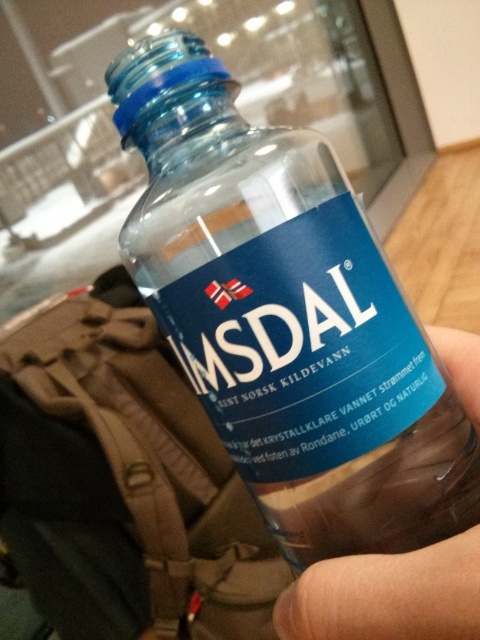
Which is behind, point (215, 220) or point (325, 634)?

Positioned behind is point (215, 220).

Between transparent glass bottle at center and transparent plastic hand at lower right, which one is positioned higher?

Positioned higher is transparent glass bottle at center.

Between point (298, 240) and point (451, 566), which one is positioned in front?

Point (451, 566)

Locate an element on the screen. transparent glass bottle at center is located at coordinates (288, 317).